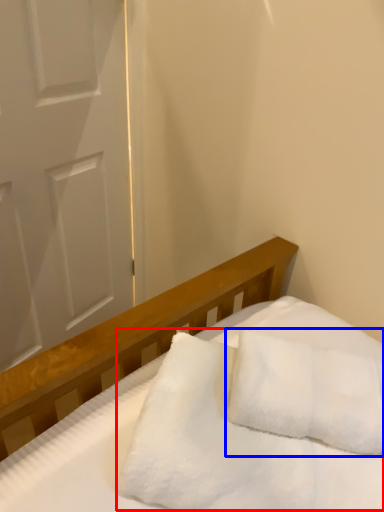
Question: Which point is closer to the camera, blanket (highlighted by a red box) or pillow (highlighted by a blue box)?

Choices:
 (A) blanket
 (B) pillow

Answer: (A)